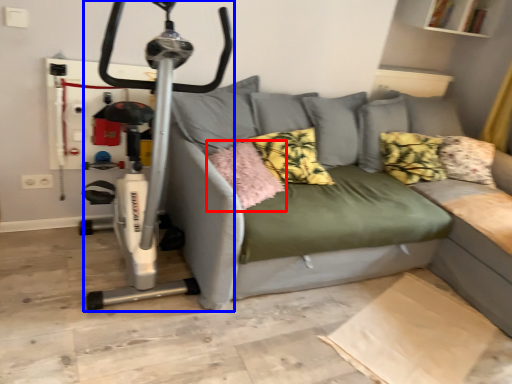
Question: Among these objects, which one is nearest to the camera, pillow (highlighted by a red box) or sport equipment (highlighted by a blue box)?

Choices:
 (A) pillow
 (B) sport equipment

Answer: (B)